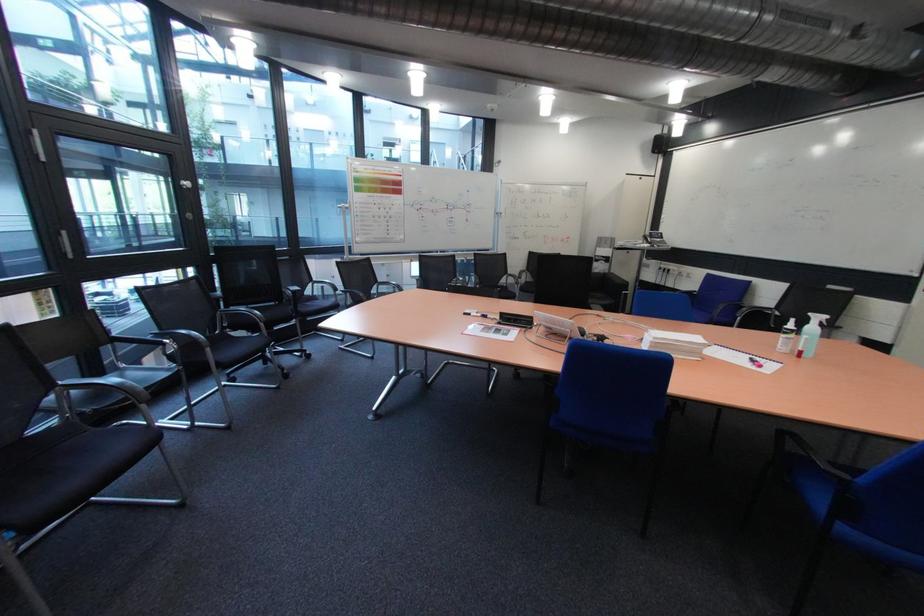
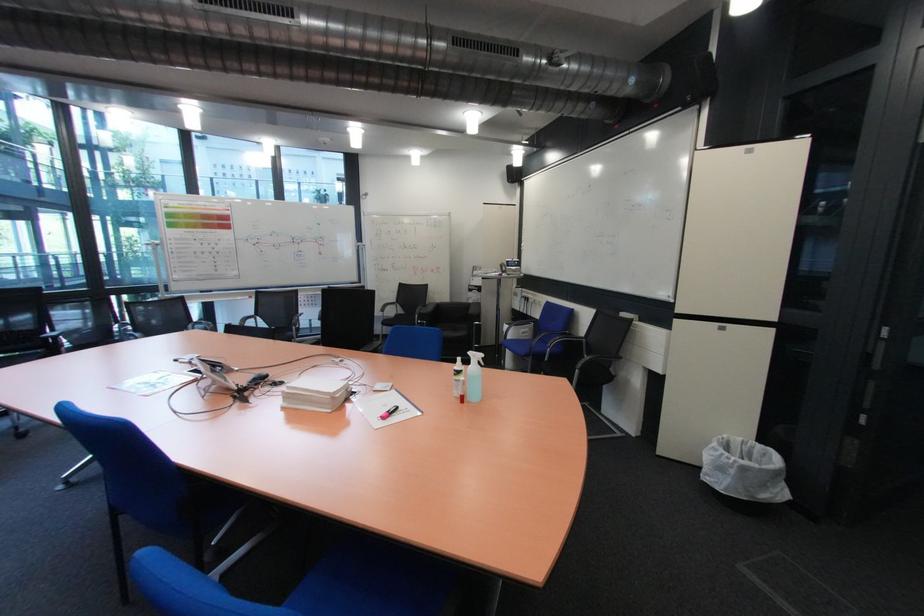
Question: In a continuous first-person perspective shot, in which direction is the camera moving?

Choices:
 (A) Left
 (B) Right
 (C) Forward
 (D) Backward

Answer: (B)